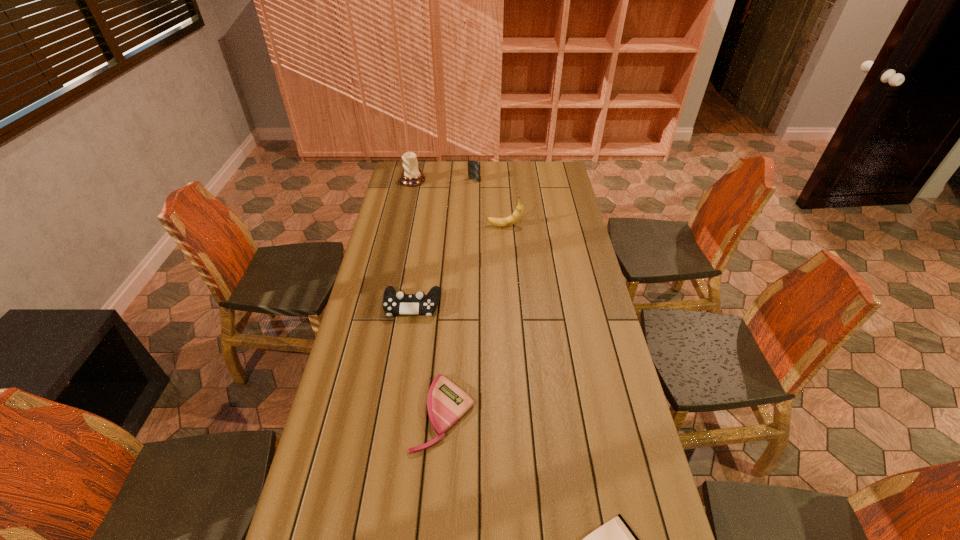
The height and width of the screenshot is (540, 960). I want to click on free region at the right edge of the desktop, so click(648, 530).

In the image, there is a desktop. What are the coordinates of `free space at the far right corner` in the screenshot? It's located at (564, 169).

At what (x,y) coordinates should I click in order to perform the action: click on free spot between the fourth tallest object and the banana. Please return your answer as a coordinate pair (x, y). This screenshot has width=960, height=540. Looking at the image, I should click on (458, 266).

In order to click on free area in between the candle holder and the cellular telephone in this screenshot , I will do `click(444, 180)`.

You are a GUI agent. You are given a task and a screenshot of the screen. Output one action in this format:
    pyautogui.click(x=<x>, y=<y>)
    Task: Click on the vacant area that lies between the second nearest object and the cellular telephone
    The image size is (960, 540).
    Given the screenshot: What is the action you would take?
    pyautogui.click(x=459, y=296)

Image resolution: width=960 pixels, height=540 pixels. In order to click on vacant area that lies between the fourth tallest object and the wristlet in this screenshot , I will do `click(428, 360)`.

This screenshot has width=960, height=540. Identify the location of object that is the second closest to the second nearest object. (394, 303).

Identify which object is the second nearest to the banana. Please provide its 2D coordinates. Your answer should be formatted as a tuple, i.e. [(x, y)], where the tuple contains the x and y coordinates of a point satisfying the conditions above.

[(394, 303)]